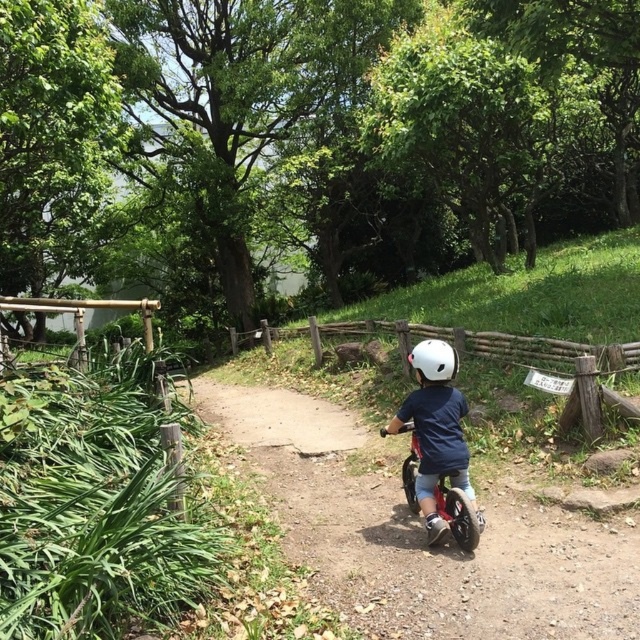
Question: Which point is farther to the camera?

Choices:
 (A) smooth dirt path at center
 (B) orange matte bicycle at center
 (C) white matte helmet at center

Answer: (C)

Question: Is orange matte bicycle at center smaller than white matte helmet at center?

Choices:
 (A) no
 (B) yes

Answer: (A)

Question: Which object is positioned farthest from the white matte helmet at center?

Choices:
 (A) orange matte bicycle at center
 (B) smooth dirt path at center

Answer: (B)

Question: Which object is farther from the camera taking this photo?

Choices:
 (A) smooth dirt path at center
 (B) white matte helmet at center
 (C) orange matte bicycle at center

Answer: (B)

Question: Does smooth dirt path at center come behind white matte helmet at center?

Choices:
 (A) no
 (B) yes

Answer: (A)

Question: Can you confirm if smooth dirt path at center is positioned to the left of orange matte bicycle at center?

Choices:
 (A) yes
 (B) no

Answer: (A)